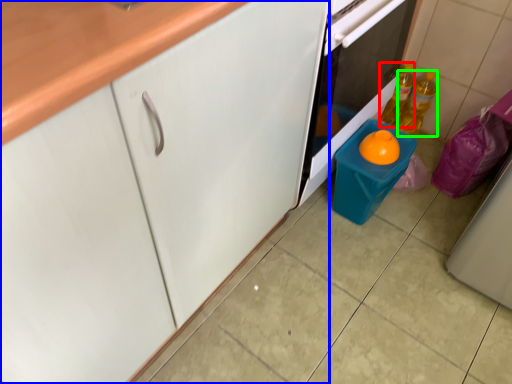
Question: Which object is positioned closest to bottle (highlighted by a red box)? Select from cabinetry (highlighted by a blue box) and bottle (highlighted by a green box).

Choices:
 (A) cabinetry
 (B) bottle

Answer: (B)